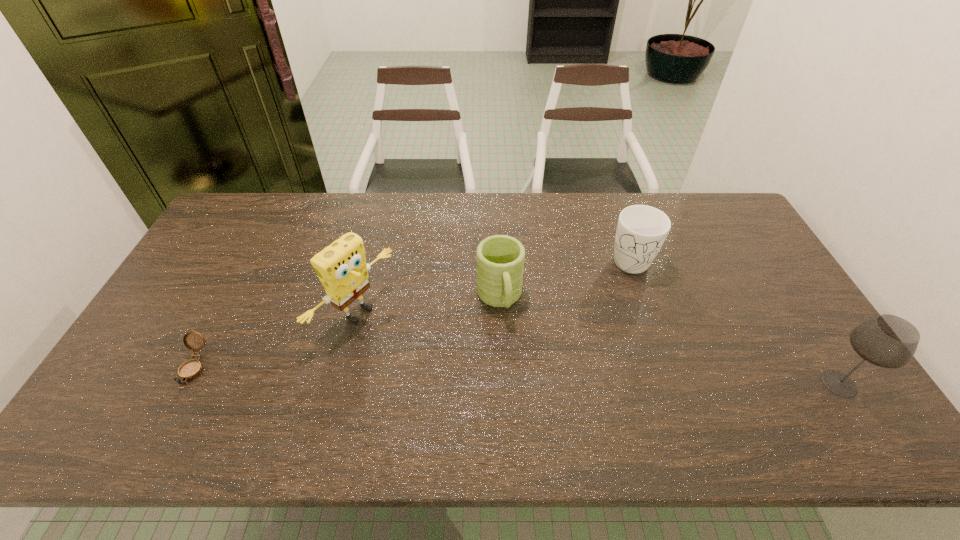
The height and width of the screenshot is (540, 960). Find the location of `object that is positioned at the near left corner`. object that is positioned at the near left corner is located at coordinates (191, 369).

Where is `object positioned at the near right corner`? This screenshot has height=540, width=960. object positioned at the near right corner is located at coordinates (888, 341).

The width and height of the screenshot is (960, 540). Identify the location of vacant region at the far edge of the desktop. (512, 227).

Identify the location of free location at the near edge of the desktop. This screenshot has width=960, height=540. (216, 372).

In the image, there is a desktop. Find the location of `vacant space at the far left corner`. vacant space at the far left corner is located at coordinates (249, 204).

Find the location of a particular element. free space at the far right corner of the desktop is located at coordinates (726, 202).

I want to click on free space at the near right corner, so click(x=795, y=399).

Locate an element on the screen. Image resolution: width=960 pixels, height=540 pixels. vacant area between the leftmost object and the sponge is located at coordinates (276, 340).

At what (x,y) coordinates should I click in order to perform the action: click on empty space between the fourth object from right to left and the left mug. Please return your answer as a coordinate pair (x, y). Looking at the image, I should click on (428, 306).

This screenshot has height=540, width=960. In order to click on free space that is in between the compass and the fourth object from right to left in this screenshot , I will do `click(276, 340)`.